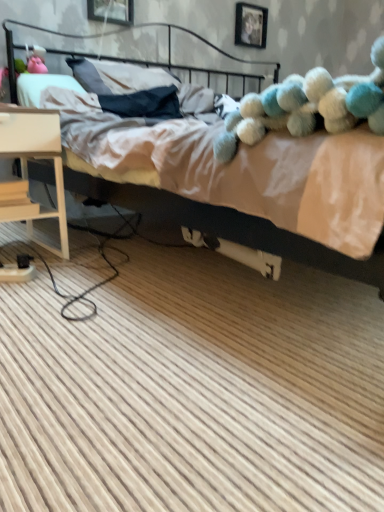
Question: Is light wood nightstand at lower left at the right side of black metal headboard at upper center?

Choices:
 (A) no
 (B) yes

Answer: (A)

Question: Is light wood nightstand at lower left facing away from black metal headboard at upper center?

Choices:
 (A) no
 (B) yes

Answer: (A)

Question: Is light wood nightstand at lower left shorter than black metal headboard at upper center?

Choices:
 (A) yes
 (B) no

Answer: (B)

Question: Can you confirm if light wood nightstand at lower left is wider than black metal headboard at upper center?

Choices:
 (A) no
 (B) yes

Answer: (A)

Question: From the image's perspective, would you say light wood nightstand at lower left is positioned over black metal headboard at upper center?

Choices:
 (A) no
 (B) yes

Answer: (A)

Question: Does light wood nightstand at lower left have a smaller size compared to black metal headboard at upper center?

Choices:
 (A) yes
 (B) no

Answer: (A)

Question: Considering the relative positions of fluffy blue and white teddy bear at upper right and beige fabric bed at upper center in the image provided, is fluffy blue and white teddy bear at upper right behind beige fabric bed at upper center?

Choices:
 (A) yes
 (B) no

Answer: (A)

Question: Can you confirm if fluffy blue and white teddy bear at upper right is wider than beige fabric bed at upper center?

Choices:
 (A) yes
 (B) no

Answer: (B)

Question: Is fluffy blue and white teddy bear at upper right at the left side of beige fabric bed at upper center?

Choices:
 (A) no
 (B) yes

Answer: (B)

Question: From a real-world perspective, is fluffy blue and white teddy bear at upper right located higher than beige fabric bed at upper center?

Choices:
 (A) no
 (B) yes

Answer: (B)

Question: Does fluffy blue and white teddy bear at upper right have a lesser height compared to beige fabric bed at upper center?

Choices:
 (A) yes
 (B) no

Answer: (A)

Question: Is fluffy blue and white teddy bear at upper right looking in the opposite direction of beige fabric bed at upper center?

Choices:
 (A) no
 (B) yes

Answer: (B)

Question: Does black metal headboard at upper center turn towards light wood nightstand at lower left?

Choices:
 (A) no
 (B) yes

Answer: (A)